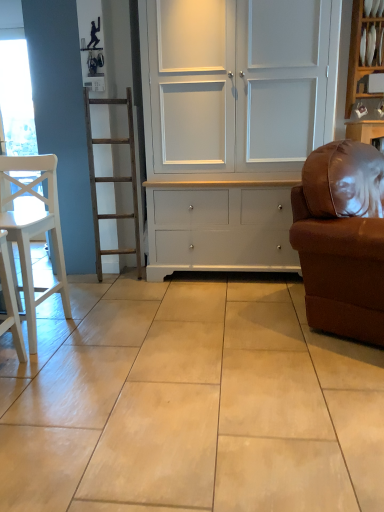
The width and height of the screenshot is (384, 512). What do you see at coordinates (232, 125) in the screenshot?
I see `white painted wood cupboard at center` at bounding box center [232, 125].

At what (x,y) coordinates should I click in order to perform the action: click on brown leather couch at right. Please return your answer as a coordinate pair (x, y). Looking at the image, I should click on (342, 239).

I want to click on white glossy shelf at upper right, so click(370, 84).

Does white painted wood cupboard at center touch white matte chair at left?

white painted wood cupboard at center is not next to white matte chair at left, and they're not touching.

Is white painted wood cupboard at center thinner than white matte chair at left?

Incorrect, the width of white painted wood cupboard at center is not less than that of white matte chair at left.

How far apart are white painted wood cupboard at center and white matte chair at left?

They are 3.52 feet apart.

Is white painted wood cupboard at center to the left of white matte chair at left from the viewer's perspective?

No.

Between brown leather couch at right and white matte chair at left, which one has more height?

Standing taller between the two is brown leather couch at right.

Is point (376, 331) closer to camera compared to point (13, 182)?

That is True.

Between brown leather couch at right and white matte chair at left, which one has larger size?

With larger size is brown leather couch at right.

Is white painted wood cupboard at center taller than brown leather couch at right?

Correct, white painted wood cupboard at center is much taller as brown leather couch at right.

Which object is further away from the camera, white painted wood cupboard at center or brown leather couch at right?

white painted wood cupboard at center.

Is white painted wood cupboard at center positioned with its back to brown leather couch at right?

No, brown leather couch at right is not at the back of white painted wood cupboard at center.

From the image's perspective, is white painted wood cupboard at center positioned above or below brown leather couch at right?

Clearly, from the image's perspective, white painted wood cupboard at center is above brown leather couch at right.

Considering the positions of objects white glossy shelf at upper right and white painted wood cupboard at center in the image provided, who is more to the left, white glossy shelf at upper right or white painted wood cupboard at center?

white painted wood cupboard at center.

Which point is more forward, (356, 92) or (167, 173)?

The point (167, 173) is closer to the camera.

Considering the sizes of objects white glossy shelf at upper right and white painted wood cupboard at center in the image provided, who is smaller, white glossy shelf at upper right or white painted wood cupboard at center?

With smaller size is white glossy shelf at upper right.

Consider the image. Who is more distant, white glossy shelf at upper right or white painted wood cupboard at center?

white glossy shelf at upper right is further away from the camera.

Considering the positions of objects white matte chair at left and white glossy shelf at upper right in the image provided, who is in front, white matte chair at left or white glossy shelf at upper right?

white matte chair at left is in front.

Are white matte chair at left and white glossy shelf at upper right beside each other?

No, white matte chair at left is not making contact with white glossy shelf at upper right.

From a real-world perspective, is white matte chair at left located higher than white glossy shelf at upper right?

No, from a real-world perspective, white matte chair at left is not above white glossy shelf at upper right.

Which object is positioned more to the left, white matte chair at left or white glossy shelf at upper right?

white matte chair at left.

Between brown leather couch at right and white glossy shelf at upper right, which one has less height?

With less height is white glossy shelf at upper right.

Does point (371, 205) lie behind point (375, 94)?

No, (371, 205) is in front of (375, 94).

Is brown leather couch at right next to white glossy shelf at upper right and touching it?

brown leather couch at right and white glossy shelf at upper right are not in contact.

How far apart are brown leather couch at right and white glossy shelf at upper right?

brown leather couch at right and white glossy shelf at upper right are 1.62 meters apart.

Could you tell me if white painted wood cupboard at center is facing white glossy shelf at upper right?

No, white painted wood cupboard at center is not aimed at white glossy shelf at upper right.

From a real-world perspective, is white painted wood cupboard at center physically below white glossy shelf at upper right?

Yes.

Measure the distance from white painted wood cupboard at center to white glossy shelf at upper right.

The distance of white painted wood cupboard at center from white glossy shelf at upper right is 3.82 feet.

Is white painted wood cupboard at center taller or shorter than white glossy shelf at upper right?

Considering their sizes, white painted wood cupboard at center has more height than white glossy shelf at upper right.

At what (x,y) coordinates should I click in order to perform the action: click on chair below the white painted wood cupboard at center (from the image's perspective). Please return your answer as a coordinate pair (x, y). Looking at the image, I should click on (32, 228).

Image resolution: width=384 pixels, height=512 pixels. I want to click on chair behind the brown leather couch at right, so click(x=32, y=228).

Looking at the image, which one is located further to brown leather couch at right, white matte chair at left or white glossy shelf at upper right?

Based on the image, white glossy shelf at upper right appears to be further to brown leather couch at right.

From the image, which object appears to be farther from white matte chair at left, brown leather couch at right or white glossy shelf at upper right?

The object further to white matte chair at left is white glossy shelf at upper right.

From the image, which object appears to be nearer to white painted wood cupboard at center, brown leather couch at right or white glossy shelf at upper right?

brown leather couch at right lies closer to white painted wood cupboard at center than the other object.

Looking at the image, which one is located closer to white matte chair at left, white glossy shelf at upper right or brown leather couch at right?

brown leather couch at right.

In the scene shown: Which object lies nearer to the anchor point brown leather couch at right, white matte chair at left or white painted wood cupboard at center?

white painted wood cupboard at center is closer to brown leather couch at right.

From the image, which object appears to be farther from white matte chair at left, brown leather couch at right or white painted wood cupboard at center?

brown leather couch at right is positioned further to the anchor white matte chair at left.

Considering their positions, is white matte chair at left positioned further to white painted wood cupboard at center than brown leather couch at right?

Among the two, white matte chair at left is located further to white painted wood cupboard at center.

When comparing their distances from white painted wood cupboard at center, does white glossy shelf at upper right or white matte chair at left seem further?

Based on the image, white glossy shelf at upper right appears to be further to white painted wood cupboard at center.

Identify the location of cupboard between white matte chair at left and white glossy shelf at upper right from left to right. The height and width of the screenshot is (512, 384). (232, 125).

The image size is (384, 512). Find the location of `studio couch between white matte chair at left and white glossy shelf at upper right in the horizontal direction`. studio couch between white matte chair at left and white glossy shelf at upper right in the horizontal direction is located at coordinates (342, 239).

The width and height of the screenshot is (384, 512). In order to click on cupboard between brown leather couch at right and white glossy shelf at upper right in the front-back direction in this screenshot , I will do `click(232, 125)`.

This screenshot has height=512, width=384. In order to click on cupboard between white matte chair at left and brown leather couch at right from left to right in this screenshot , I will do coord(232,125).